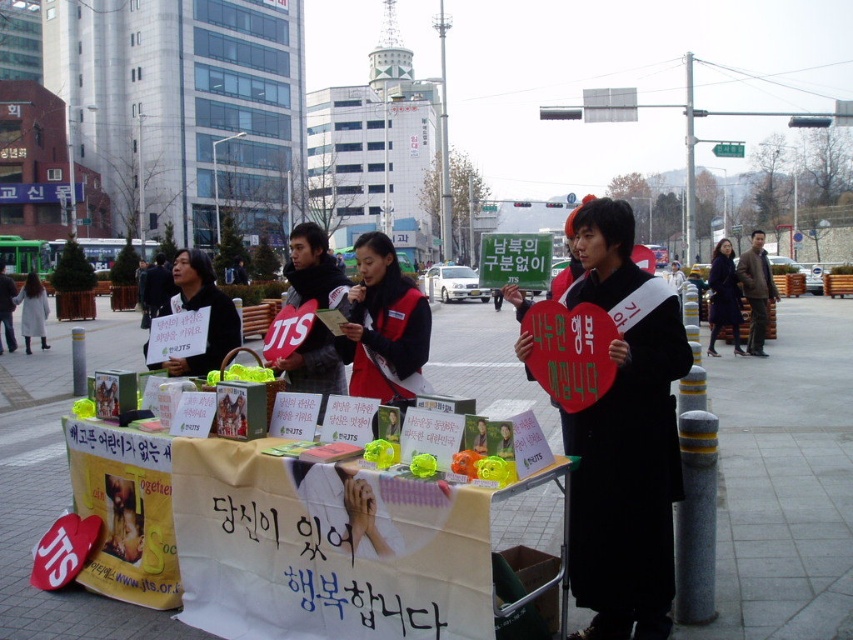
Who is higher up, black matte coat at center or red fabric vest at center?

Positioned higher is red fabric vest at center.

Is black matte coat at center to the right of red fabric vest at center from the viewer's perspective?

Correct, you'll find black matte coat at center to the right of red fabric vest at center.

What do you see at coordinates (625, 438) in the screenshot?
I see `black matte coat at center` at bounding box center [625, 438].

You are a GUI agent. You are given a task and a screenshot of the screen. Output one action in this format:
    pyautogui.click(x=<x>, y=<y>)
    Task: Click on the black matte coat at center
    This screenshot has height=640, width=853.
    Given the screenshot: What is the action you would take?
    pyautogui.click(x=625, y=438)

Who is more distant from viewer, (492,336) or (27,342)?

The point (492,336) is more distant.

Is matte black cart at center thinner than white wool coat at center?

No.

At what (x,y) coordinates should I click in order to perform the action: click on matte black cart at center. Please return your answer as a coordinate pair (x, y). The height and width of the screenshot is (640, 853). Looking at the image, I should click on (785, 481).

Is black matte coat at center to the right of white wool coat at center from the viewer's perspective?

Yes, black matte coat at center is to the right of white wool coat at center.

Is black matte coat at center wider than white wool coat at center?

No.

Is point (663, 605) closer to camera compared to point (32, 326)?

Yes, point (663, 605) is closer to viewer.

This screenshot has width=853, height=640. Find the location of `black matte coat at center`. black matte coat at center is located at coordinates (625, 438).